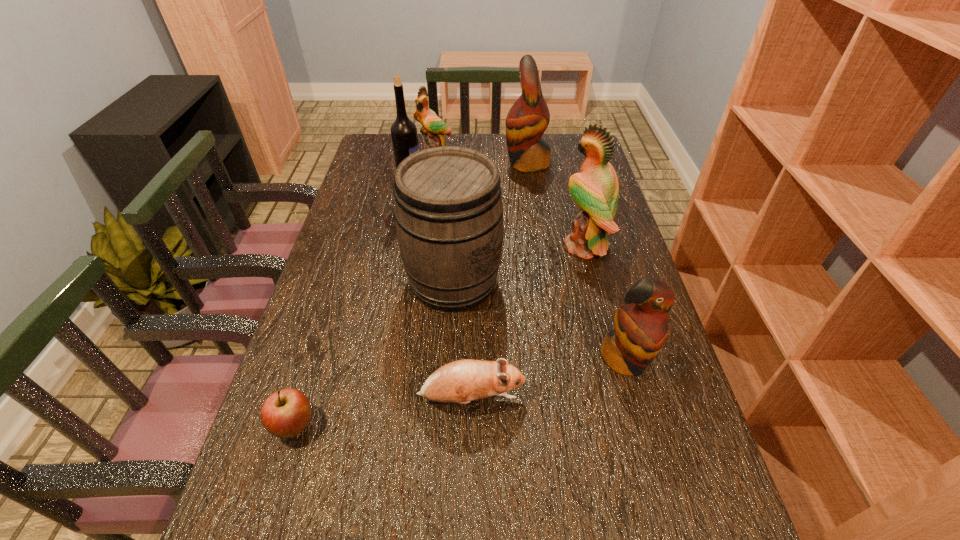
This screenshot has height=540, width=960. In the image, there is a desktop. Find the location of `free space at the far left corner`. free space at the far left corner is located at coordinates (374, 140).

This screenshot has height=540, width=960. Find the location of `free space between the nearer green parrot and the apple`. free space between the nearer green parrot and the apple is located at coordinates 440,336.

The height and width of the screenshot is (540, 960). What are the coordinates of `empty location between the hamster and the nearer green parrot` in the screenshot? It's located at (528, 322).

I want to click on unoccupied position between the hamster and the wine bucket, so click(x=463, y=340).

Locate an element on the screen. The image size is (960, 540). free spot between the bigger green parrot and the left green parrot is located at coordinates (510, 202).

Choose which object is the nearest neighbor to the wine bucket. Please provide its 2D coordinates. Your answer should be formatted as a tuple, i.e. [(x, y)], where the tuple contains the x and y coordinates of a point satisfying the conditions above.

[(595, 190)]

Locate which object ranks fourth in proximity to the farther green parrot. Please provide its 2D coordinates. Your answer should be formatted as a tuple, i.e. [(x, y)], where the tuple contains the x and y coordinates of a point satisfying the conditions above.

[(595, 190)]

This screenshot has width=960, height=540. Find the location of `parrot that is the third closest to the left red parrot`. parrot that is the third closest to the left red parrot is located at coordinates (640, 331).

Locate which parrot ranks third in proximity to the left green parrot. Please provide its 2D coordinates. Your answer should be formatted as a tuple, i.e. [(x, y)], where the tuple contains the x and y coordinates of a point satisfying the conditions above.

[(640, 331)]

Find the location of a particular element. The height and width of the screenshot is (540, 960). vacant position in the image that satisfies the following two spatial constraints: 1. on the face of the right red parrot; 2. at the face of the brown hamster is located at coordinates (636, 399).